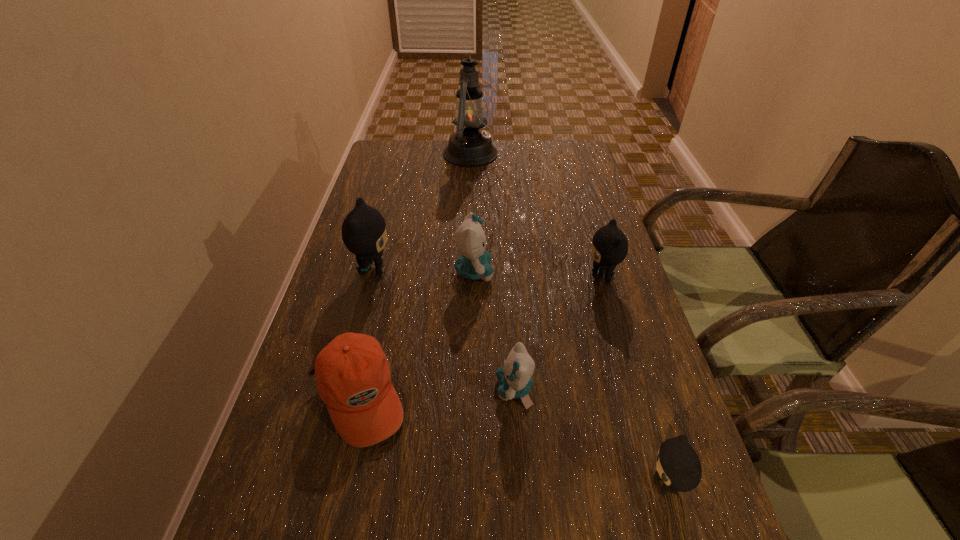
The height and width of the screenshot is (540, 960). I want to click on oil lamp, so click(x=468, y=146).

The width and height of the screenshot is (960, 540). Identify the location of the farthest object. (468, 146).

The image size is (960, 540). Find the location of `the leftmost kitten`. the leftmost kitten is located at coordinates (364, 232).

Locate an element on the screen. This screenshot has height=540, width=960. the biggest gray kitten is located at coordinates (364, 232).

Locate an element on the screen. The height and width of the screenshot is (540, 960). the farther blue kitten is located at coordinates (474, 264).

Find the location of a particular element. The image size is (960, 540). the second biggest gray kitten is located at coordinates (609, 244).

Image resolution: width=960 pixels, height=540 pixels. I want to click on the nearer blue kitten, so click(515, 379).

Locate an element on the screen. the smaller blue kitten is located at coordinates (515, 379).

Where is `baseball cap`? The image size is (960, 540). baseball cap is located at coordinates (353, 376).

Locate an element on the screen. Image resolution: width=960 pixels, height=540 pixels. the nearest gray kitten is located at coordinates (678, 466).